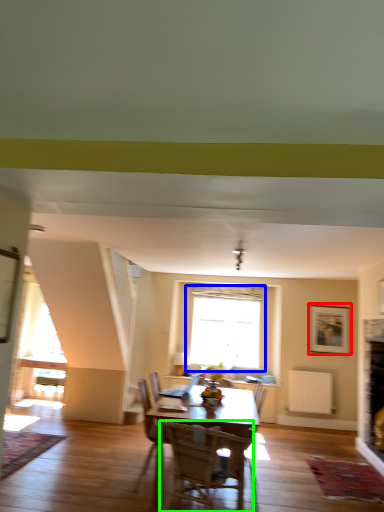
Question: Estimate the real-world distances between objects in this image. Which object is closer to picture frame (highlighted by a red box), window (highlighted by a blue box) or chair (highlighted by a green box)?

Choices:
 (A) window
 (B) chair

Answer: (A)